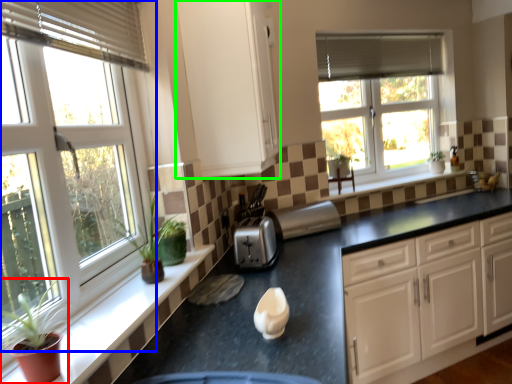
Question: Which object is positioned closest to houseplant (highlighted by a red box)? Select from window (highlighted by a blue box) and cabinetry (highlighted by a green box).

Choices:
 (A) window
 (B) cabinetry

Answer: (A)